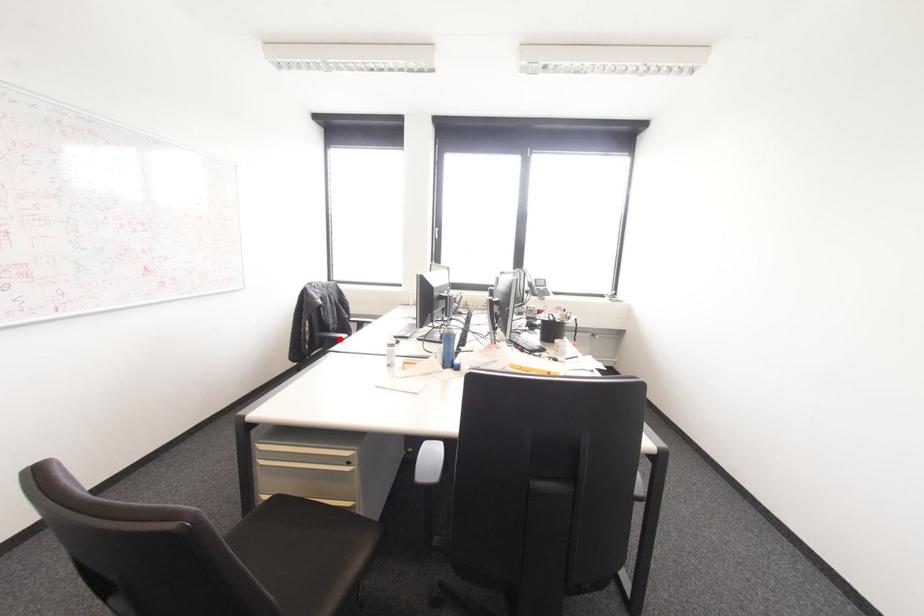
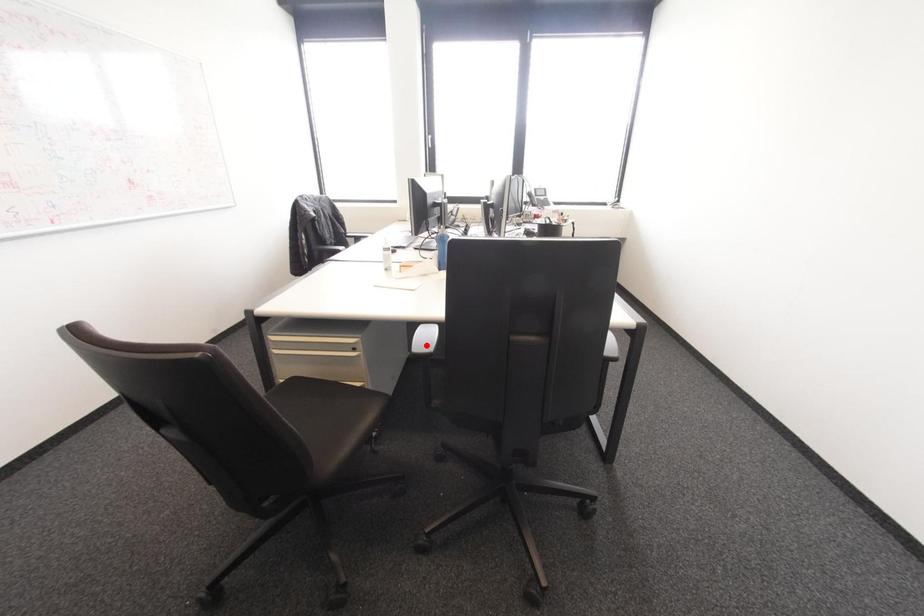
I am providing you with two images of the same scene from different viewpoints. A red point is marked on the first image and another point is marked on the second image. Is the red point in image1 aligned with the point shown in image2?

No